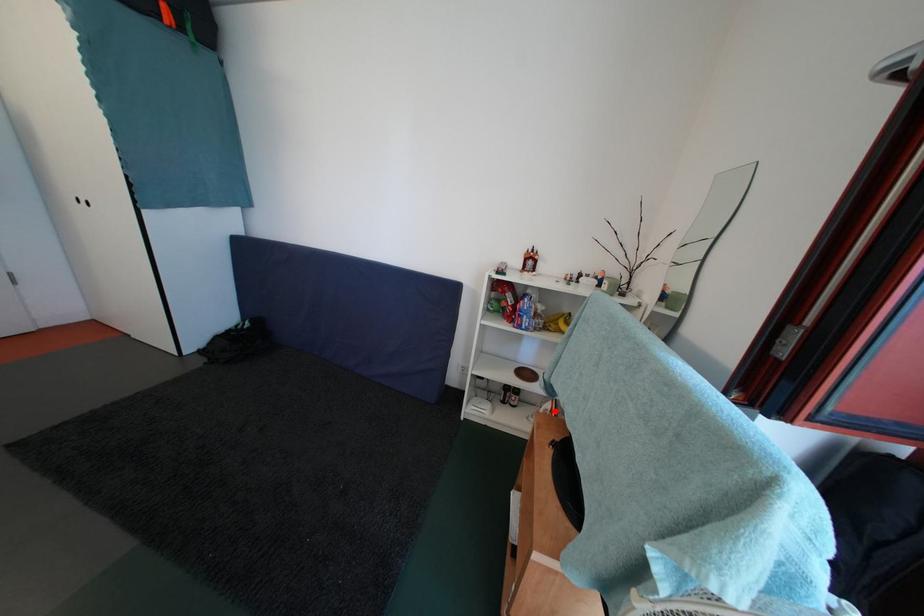
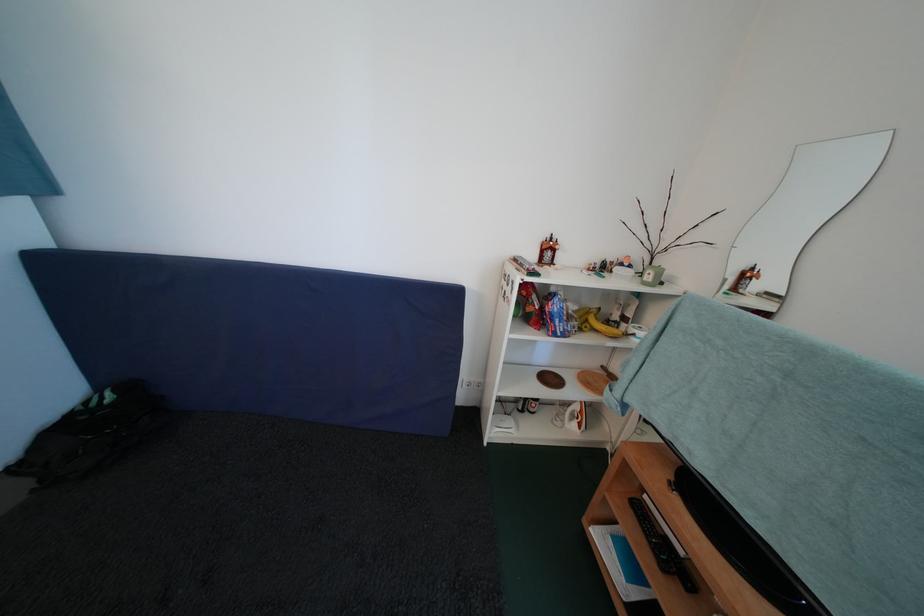
The point at the highlighted location is marked in the first image. Where is the corresponding point in the second image?

(584, 411)